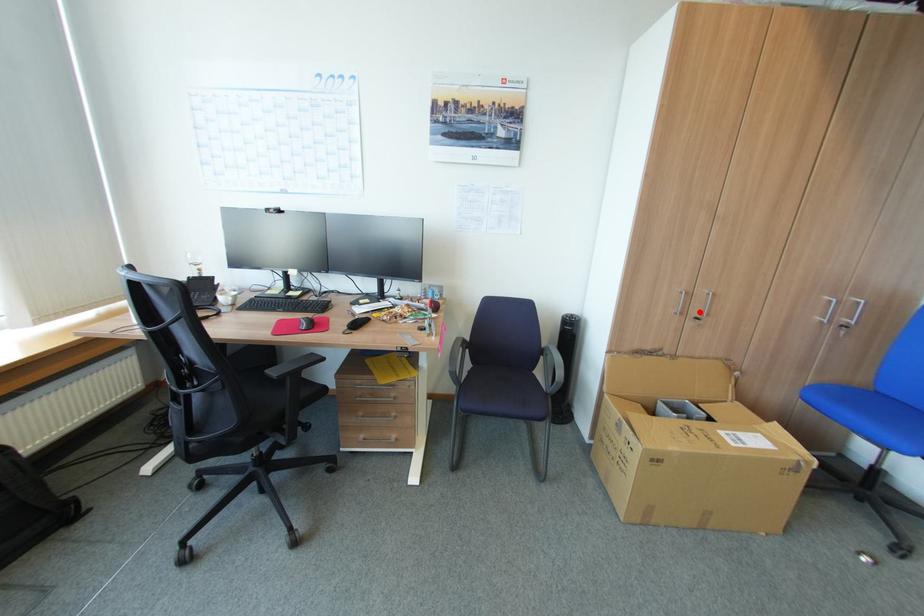
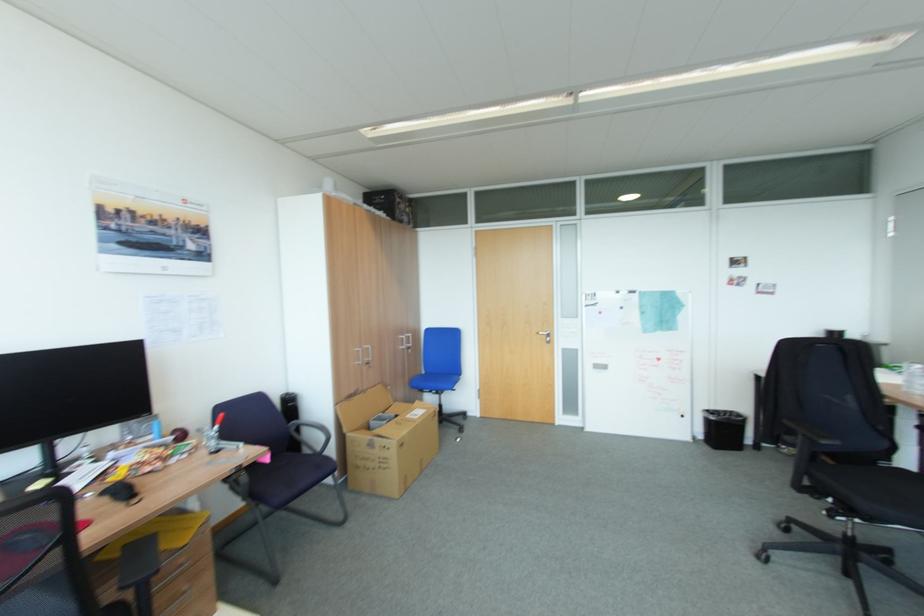
Where in the second image is the point corresponding to the highlighted location from the first image?

(371, 360)